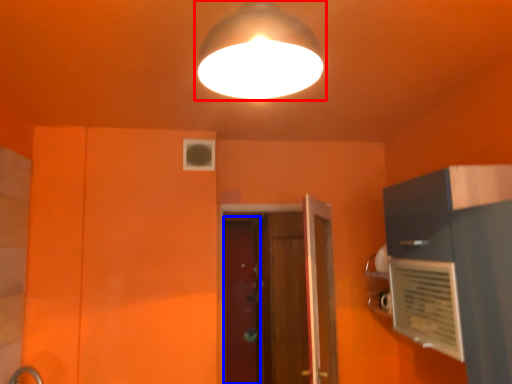
Question: Which point is closer to the camera, lamp (highlighted by a red box) or screen door (highlighted by a blue box)?

Choices:
 (A) lamp
 (B) screen door

Answer: (A)